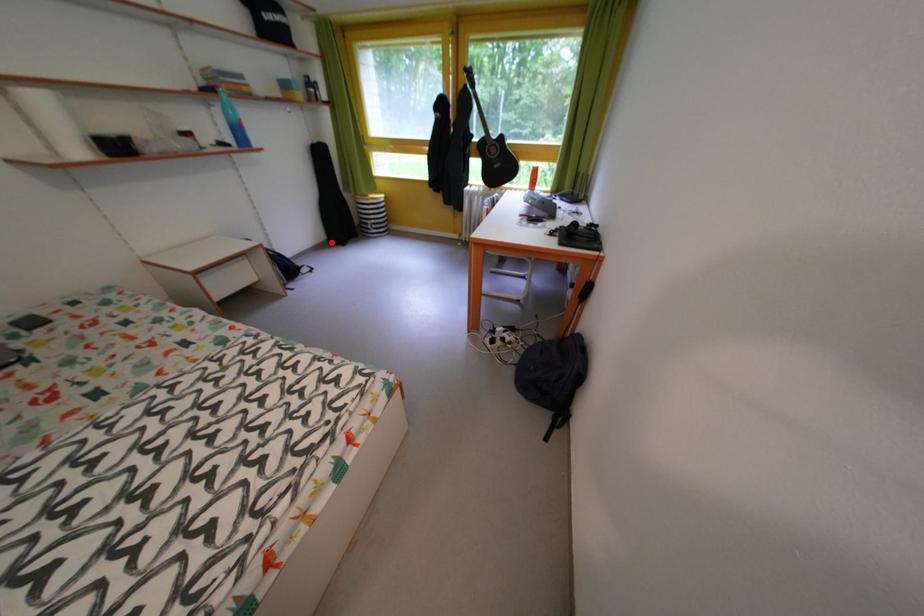
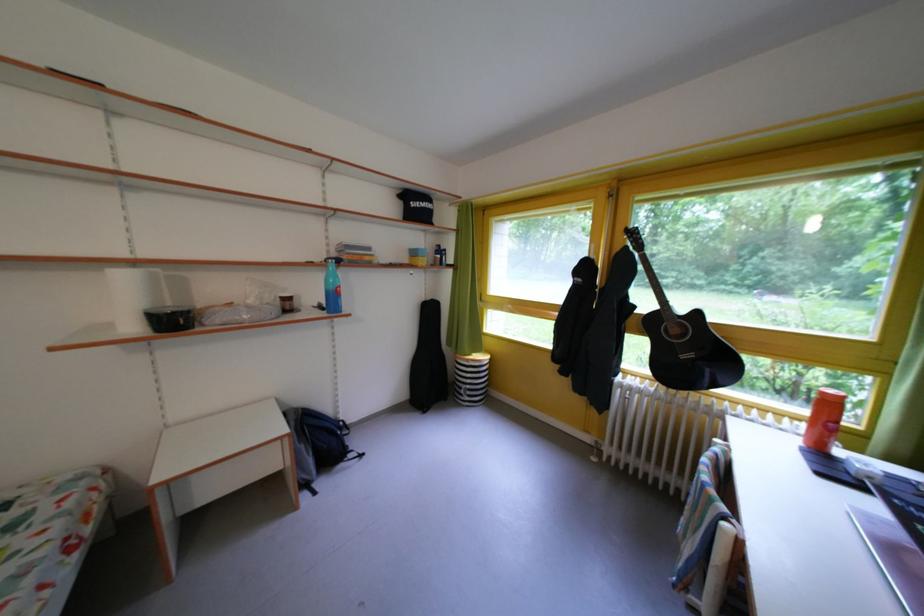
Question: I am providing you with two images of the same scene from different viewpoints. In image1, a red point is highlighted. Considering the same 3D point in image2, which of the following is correct?

Choices:
 (A) It is closer
 (B) It is farther

Answer: (B)